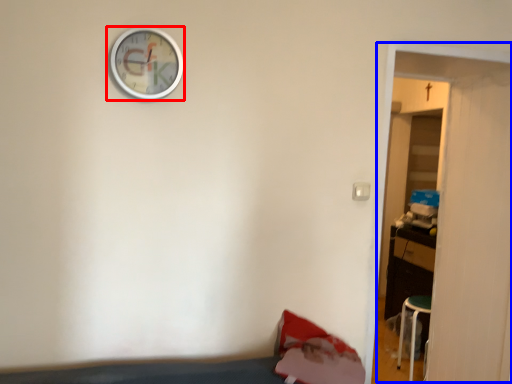
Question: Among these objects, which one is nearest to the camera, wall clock (highlighted by a red box) or door (highlighted by a blue box)?

Choices:
 (A) wall clock
 (B) door

Answer: (A)